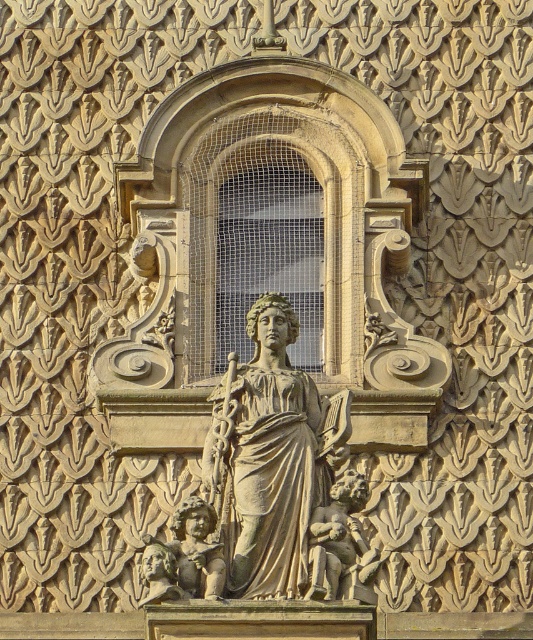
You are standing in front of the building facade and notice the beige stone statue at center. Can you determine its exact position using the coordinate system provided?

The beige stone statue at center is located at point coordinates (270,458).

You are a restoration worker standing at the base of the building. You need to move a 5.5 feet long ladder from the beige stone statue at center to the smooth stone cherub at center. Can you place the ladder between them without it overlapping either object?

The distance between the beige stone statue at center and the smooth stone cherub at center is 6.03 feet. Since the ladder is 5.5 feet long, it can be placed between them without overlapping either object as there is enough space.

You are an architect analyzing the building facade. You notice two central elements, the beige stone statue at center and the smooth stone cherub at center. Which one do you think is bigger?

The beige stone statue at center is larger in size than the smooth stone cherub at center.